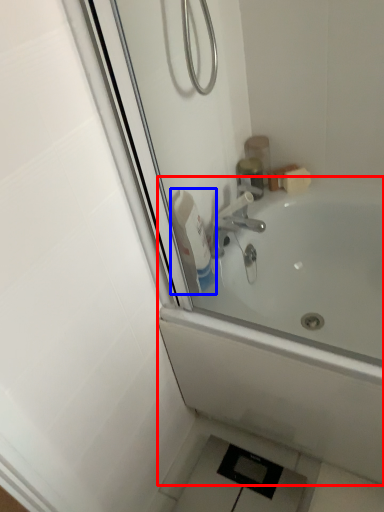
Question: Which object is further to the camera taking this photo, bathtub (highlighted by a red box) or cleaning product (highlighted by a blue box)?

Choices:
 (A) bathtub
 (B) cleaning product

Answer: (B)